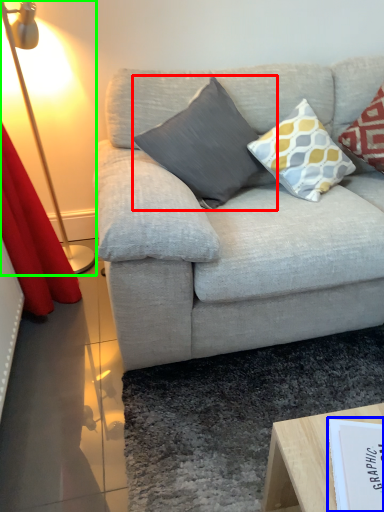
Question: Considering the real-world distances, which object is closest to pillow (highlighted by a red box)? paperback book (highlighted by a blue box) or table lamp (highlighted by a green box).

Choices:
 (A) paperback book
 (B) table lamp

Answer: (B)